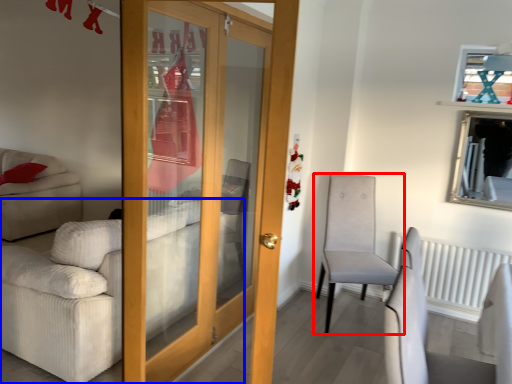
Question: Among these objects, which one is farthest to the camera, chair (highlighted by a red box) or studio couch (highlighted by a blue box)?

Choices:
 (A) chair
 (B) studio couch

Answer: (A)